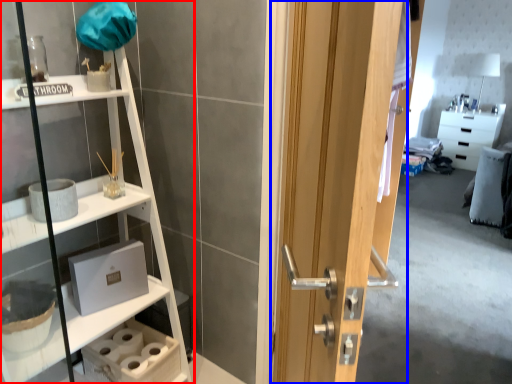
Question: Among these objects, which one is nearest to the camera, shelf (highlighted by a red box) or door (highlighted by a blue box)?

Choices:
 (A) shelf
 (B) door

Answer: (B)